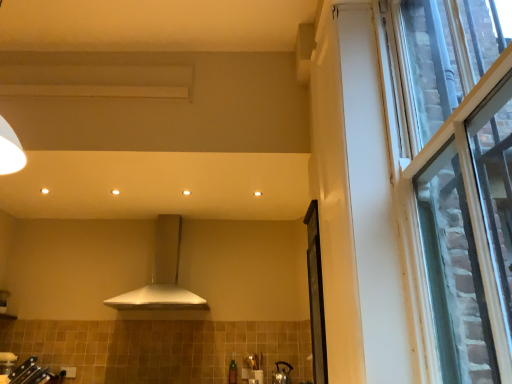
Question: From the image's perspective, is transparent glass screen door at right over clear glass window at right?

Choices:
 (A) no
 (B) yes

Answer: (A)

Question: Is transparent glass screen door at right aimed at clear glass window at right?

Choices:
 (A) yes
 (B) no

Answer: (B)

Question: Does transparent glass screen door at right have a lesser height compared to clear glass window at right?

Choices:
 (A) no
 (B) yes

Answer: (B)

Question: Can you confirm if transparent glass screen door at right is wider than clear glass window at right?

Choices:
 (A) yes
 (B) no

Answer: (B)

Question: Would you say transparent glass screen door at right is outside clear glass window at right?

Choices:
 (A) no
 (B) yes

Answer: (B)

Question: In terms of size, does transparent glass screen door at right appear bigger or smaller than white matte range hood at center?

Choices:
 (A) big
 (B) small

Answer: (B)

Question: Considering the relative positions of transparent glass screen door at right and white matte range hood at center in the image provided, is transparent glass screen door at right to the left or to the right of white matte range hood at center?

Choices:
 (A) left
 (B) right

Answer: (B)

Question: Is transparent glass screen door at right in front of or behind white matte range hood at center in the image?

Choices:
 (A) behind
 (B) front

Answer: (B)

Question: From their relative heights in the image, would you say transparent glass screen door at right is taller or shorter than white matte range hood at center?

Choices:
 (A) short
 (B) tall

Answer: (B)

Question: Is clear glass window at right inside or outside of transparent glass screen door at right?

Choices:
 (A) outside
 (B) inside

Answer: (A)

Question: Visually, is clear glass window at right positioned to the left or to the right of transparent glass screen door at right?

Choices:
 (A) right
 (B) left

Answer: (A)

Question: From a real-world perspective, is clear glass window at right physically located above or below transparent glass screen door at right?

Choices:
 (A) above
 (B) below

Answer: (A)

Question: Considering the positions of clear glass window at right and transparent glass screen door at right in the image, is clear glass window at right taller or shorter than transparent glass screen door at right?

Choices:
 (A) tall
 (B) short

Answer: (A)

Question: Is white matte range hood at center inside or outside of matte silver kettle at lower center?

Choices:
 (A) inside
 (B) outside

Answer: (B)

Question: From their relative heights in the image, would you say white matte range hood at center is taller or shorter than matte silver kettle at lower center?

Choices:
 (A) short
 (B) tall

Answer: (B)